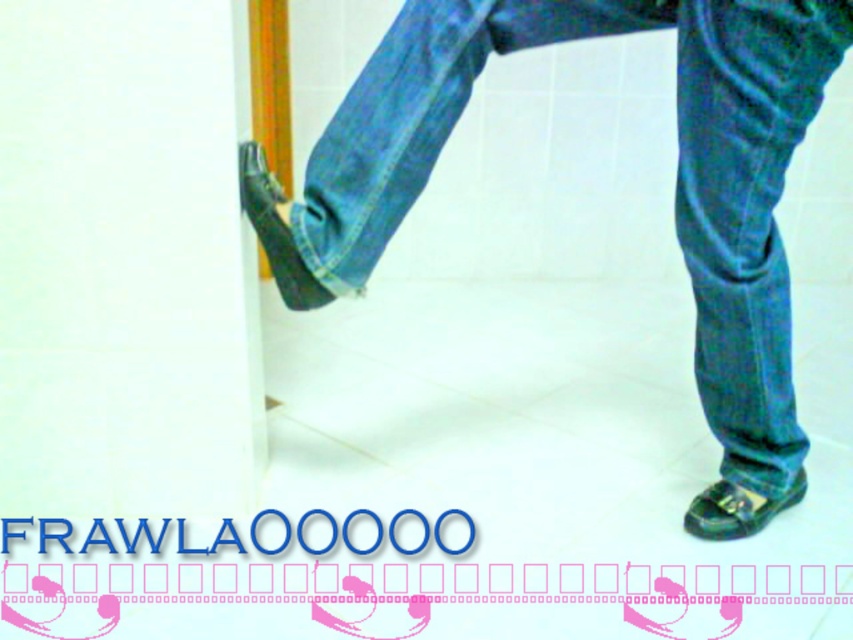
Question: Which object appears farthest from the camera in this image?

Choices:
 (A) green leather shoe at lower right
 (B) denim at left
 (C) matte black shoe at lower left

Answer: (A)

Question: Which of the following is the closest to the observer?

Choices:
 (A) matte black shoe at lower left
 (B) green leather shoe at lower right

Answer: (A)

Question: Is matte black shoe at lower left positioned behind green leather shoe at lower right?

Choices:
 (A) no
 (B) yes

Answer: (A)

Question: Which of the following is the farthest from the observer?

Choices:
 (A) green leather shoe at lower right
 (B) denim at left

Answer: (A)

Question: Does matte black shoe at lower left come behind green leather shoe at lower right?

Choices:
 (A) no
 (B) yes

Answer: (A)

Question: Is matte black shoe at lower left positioned at the back of green leather shoe at lower right?

Choices:
 (A) yes
 (B) no

Answer: (B)